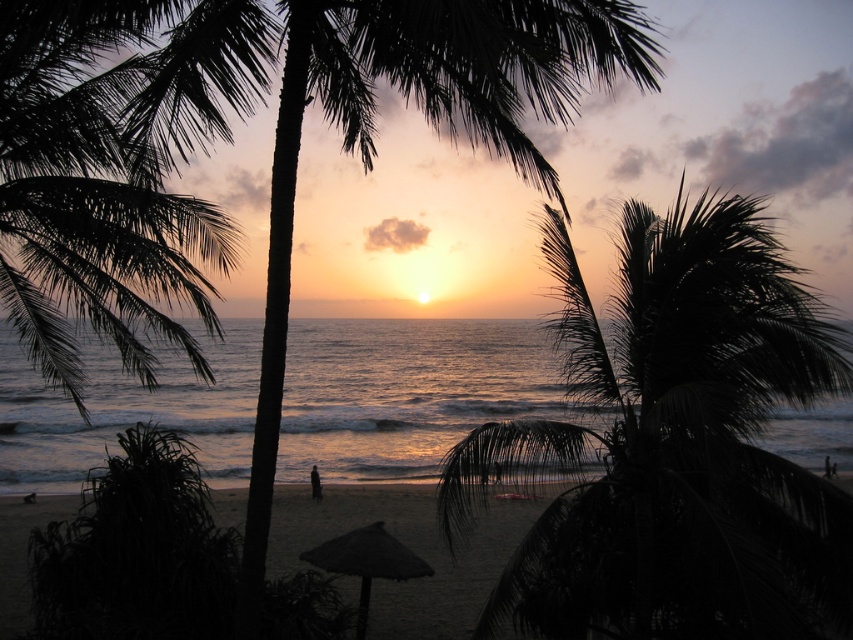
You are standing on the beach and want to find the palm tree that is easier to climb because it has a narrower trunk. Which one should you choose between the dark green leafy palm tree at center and the dark green leafy palm tree at left?

The dark green leafy palm tree at center is thinner than the dark green leafy palm tree at left, so you should choose the dark green leafy palm tree at center as it has a narrower trunk and is easier to climb.

You are standing on the beach looking at the sunset. There are two points marked in the image. The first point is at coordinates point [531,576] and the second point is at point [845,490]. Which of these points is closer to your current position?

Point [531,576] is closer to the camera than point [845,490], so the first point is closer to your current position.